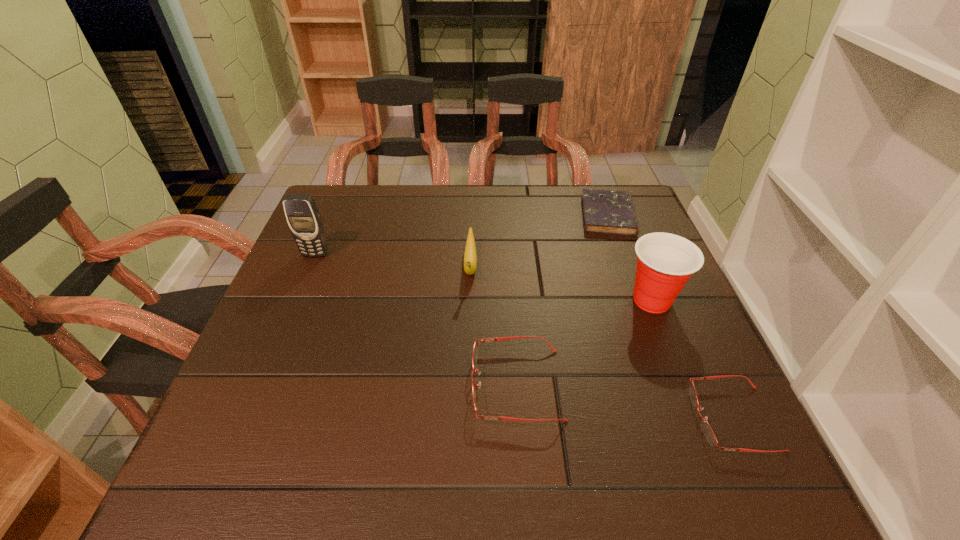
Image resolution: width=960 pixels, height=540 pixels. In order to click on vacant area situated on the lenses of the third shortest object in this screenshot , I will do `click(378, 384)`.

Locate an element on the screen. Image resolution: width=960 pixels, height=540 pixels. vacant space located 0.400m on the lenses of the third shortest object is located at coordinates (265, 384).

Identify the location of free space located on the lenses of the third shortest object. (368, 384).

You are a GUI agent. You are given a task and a screenshot of the screen. Output one action in this format:
    pyautogui.click(x=<x>, y=<y>)
    Task: Click on the free space located on the lenses of the right spectacles
    
    Given the screenshot: What is the action you would take?
    pyautogui.click(x=523, y=418)

Identify the location of vacant space located 0.070m on the lenses of the right spectacles. (656, 418).

I want to click on free spot located on the lenses of the right spectacles, so click(x=601, y=418).

This screenshot has height=540, width=960. I want to click on vacant region located on the left of the farthest object, so click(x=531, y=215).

The width and height of the screenshot is (960, 540). I want to click on vacant space situated at the stem of the banana, so click(x=468, y=353).

At what (x,y) coordinates should I click in order to perform the action: click on free space located 0.370m on the front face of the tallest object. Please return your answer as a coordinate pair (x, y). Looking at the image, I should click on (261, 382).

This screenshot has width=960, height=540. What are the coordinates of `vacant area located on the left of the fifth shortest object` in the screenshot? It's located at (536, 300).